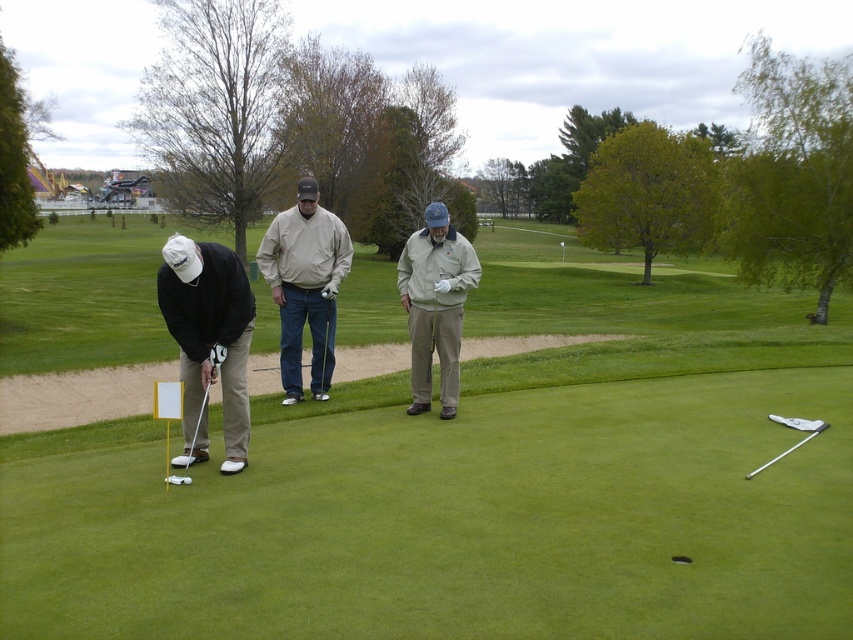
Who is positioned more to the right, green grass golf course at center or beige cotton shirt at center?

beige cotton shirt at center is more to the right.

What do you see at coordinates (477, 484) in the screenshot? I see `green grass golf course at center` at bounding box center [477, 484].

Where is `green grass golf course at center`? This screenshot has height=640, width=853. green grass golf course at center is located at coordinates (477, 484).

Is metallic silver putter at lower left smaller than metallic silver golf club at lower right?

Indeed, metallic silver putter at lower left has a smaller size compared to metallic silver golf club at lower right.

Consider the image. Which is more to the right, metallic silver putter at lower left or metallic silver golf club at lower right?

metallic silver golf club at lower right

The height and width of the screenshot is (640, 853). In order to click on metallic silver putter at lower left in this screenshot , I will do (x=206, y=392).

Which of these two, beige cotton shirt at center or metallic silver putter at lower left, stands taller?

With more height is metallic silver putter at lower left.

Is beige cotton shirt at center further to the viewer compared to metallic silver putter at lower left?

Yes, beige cotton shirt at center is behind metallic silver putter at lower left.

Who is more forward, (347,252) or (209,364)?

Point (209,364) is in front.

This screenshot has width=853, height=640. Identify the location of beige cotton shirt at center. (305, 285).